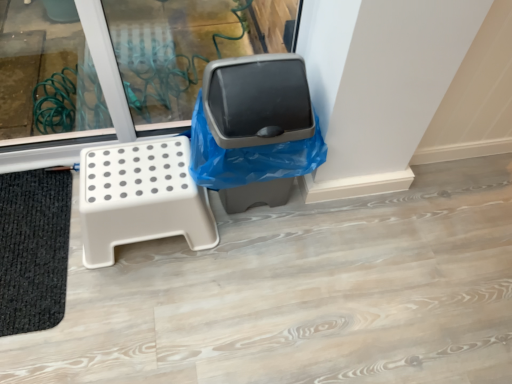
Question: Is matte plastic trash can at center to the left of black textured bath mat at lower left from the viewer's perspective?

Choices:
 (A) yes
 (B) no

Answer: (B)

Question: Considering the relative sizes of matte plastic trash can at center and black textured bath mat at lower left in the image provided, is matte plastic trash can at center bigger than black textured bath mat at lower left?

Choices:
 (A) no
 (B) yes

Answer: (B)

Question: Could black textured bath mat at lower left be considered to be inside matte plastic trash can at center?

Choices:
 (A) no
 (B) yes

Answer: (A)

Question: Is matte plastic trash can at center not within black textured bath mat at lower left?

Choices:
 (A) yes
 (B) no

Answer: (A)

Question: Is matte plastic trash can at center taller than black textured bath mat at lower left?

Choices:
 (A) no
 (B) yes

Answer: (B)

Question: Is point (33, 187) closer or farther from the camera than point (244, 79)?

Choices:
 (A) farther
 (B) closer

Answer: (A)

Question: Considering their positions, is black textured bath mat at lower left located in front of or behind matte plastic trash can at center?

Choices:
 (A) front
 (B) behind

Answer: (B)

Question: Considering the positions of black textured bath mat at lower left and matte plastic trash can at center in the image, is black textured bath mat at lower left taller or shorter than matte plastic trash can at center?

Choices:
 (A) short
 (B) tall

Answer: (A)

Question: From a real-world perspective, is black textured bath mat at lower left positioned above or below matte plastic trash can at center?

Choices:
 (A) above
 (B) below

Answer: (B)

Question: Is white plastic stool at left inside the boundaries of black textured bath mat at lower left, or outside?

Choices:
 (A) outside
 (B) inside

Answer: (A)

Question: Considering the relative positions of white plastic stool at left and black textured bath mat at lower left in the image provided, is white plastic stool at left to the left or to the right of black textured bath mat at lower left?

Choices:
 (A) left
 (B) right

Answer: (B)

Question: From the image's perspective, relative to black textured bath mat at lower left, is white plastic stool at left above or below?

Choices:
 (A) below
 (B) above

Answer: (B)

Question: Is white plastic stool at left taller or shorter than black textured bath mat at lower left?

Choices:
 (A) short
 (B) tall

Answer: (B)

Question: Is matte plastic trash can at center wider or thinner than black textured bath mat at lower left?

Choices:
 (A) wide
 (B) thin

Answer: (A)

Question: Does point (275, 119) appear closer or farther from the camera than point (1, 274)?

Choices:
 (A) farther
 (B) closer

Answer: (B)